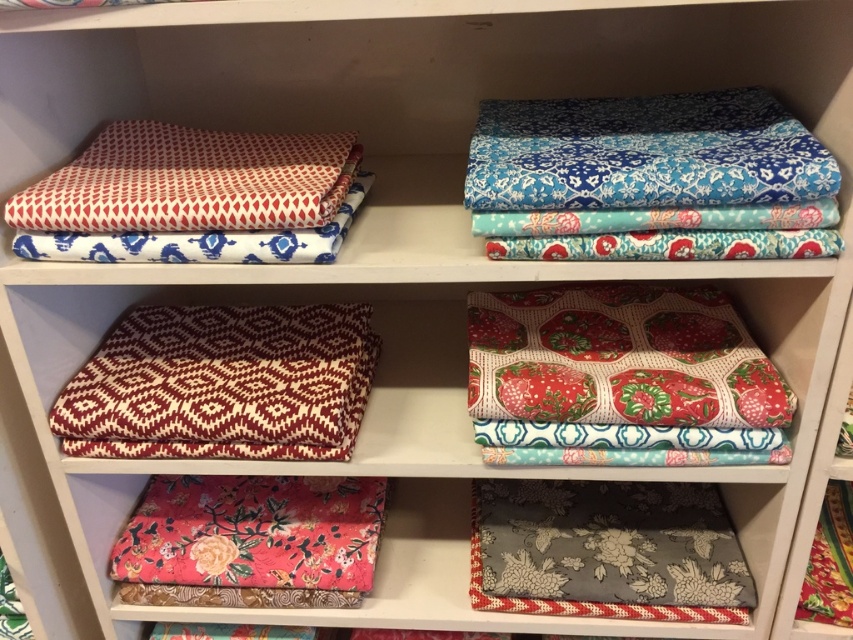
Question: Based on their relative distances, which object is farther from the maroon and cream geometric fabric at center?

Choices:
 (A) matte white fabric at upper left
 (B) floral fabric at lower left

Answer: (A)

Question: Is the position of gray floral fabric at lower right more distant than that of matte white fabric at upper left?

Choices:
 (A) no
 (B) yes

Answer: (B)

Question: Which point is closer to the camera?

Choices:
 (A) (204, 452)
 (B) (99, 230)
 (C) (279, 544)
 (D) (555, 529)

Answer: (B)

Question: Can you confirm if maroon and cream geometric fabric at center is positioned to the left of floral fabric at lower left?

Choices:
 (A) yes
 (B) no

Answer: (A)

Question: Can you confirm if gray floral fabric at lower right is wider than matte white fabric at upper left?

Choices:
 (A) yes
 (B) no

Answer: (A)

Question: Estimate the real-world distances between objects in this image. Which object is farther from the gray floral fabric at lower right?

Choices:
 (A) matte white fabric at upper left
 (B) floral fabric at lower left
 (C) maroon and cream geometric fabric at center

Answer: (A)